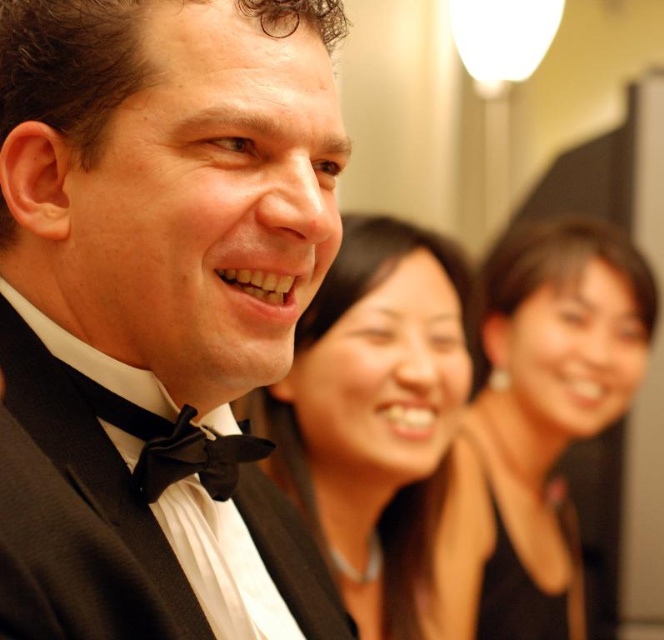
Is point (290, 468) positioned after point (218, 458)?

Yes, it is behind point (218, 458).

Is smooth black hair at center thinner than black satin bow tie at lower left?

Incorrect, smooth black hair at center's width is not less than black satin bow tie at lower left's.

Image resolution: width=664 pixels, height=640 pixels. Identify the location of smooth black hair at center. (384, 433).

Does smooth black hair at center appear over matte black dress at center?

Yes, smooth black hair at center is above matte black dress at center.

Between point (355, 381) and point (539, 305), which one is positioned behind?

The point (539, 305) is more distant.

Who is more forward, (444, 324) or (493, 593)?

Point (444, 324) is more forward.

The image size is (664, 640). Identify the location of smooth black hair at center. (384, 433).

Which is more to the left, matte black dress at center or black satin bow tie at lower left?

black satin bow tie at lower left

Is point (572, 337) positioned before point (216, 445)?

No, it is not.

Is point (444, 588) closer to camera compared to point (214, 483)?

No.

You are a GUI agent. You are given a task and a screenshot of the screen. Output one action in this format:
    pyautogui.click(x=<x>, y=<y>)
    Task: Click on the matte black dress at center
    The width and height of the screenshot is (664, 640).
    Given the screenshot: What is the action you would take?
    pyautogui.click(x=537, y=424)